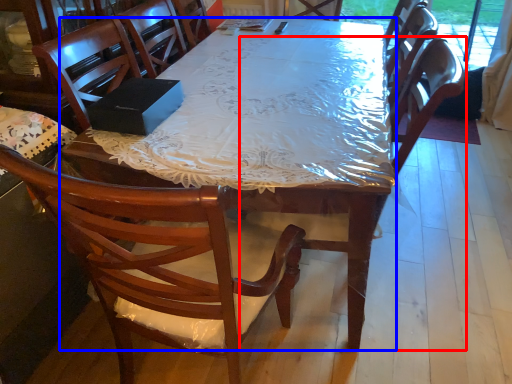
Question: Which object is further to the camera taking this photo, armchair (highlighted by a red box) or desk (highlighted by a blue box)?

Choices:
 (A) armchair
 (B) desk

Answer: (A)